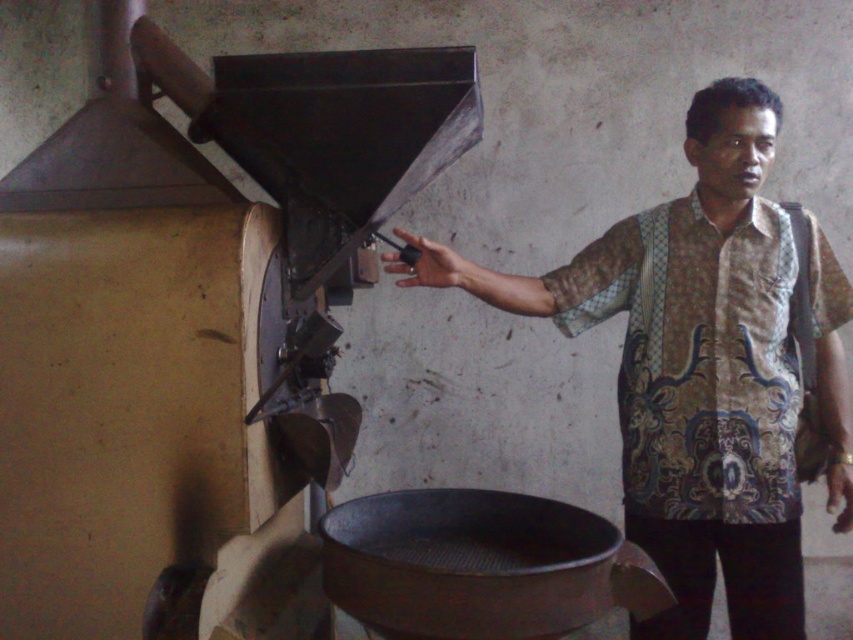
Which is in front, point (621, 225) or point (732, 518)?

Point (732, 518) is more forward.

Does batik shirt at center appear on the right side of batik fabric shirt at right?

In fact, batik shirt at center is to the left of batik fabric shirt at right.

Which is behind, point (587, 298) or point (840, 275)?

Point (840, 275)

What are the coordinates of `batik shirt at center` in the screenshot? It's located at (699, 371).

Does batik fabric shirt at right have a larger size compared to metallic at left?

Yes, batik fabric shirt at right is bigger than metallic at left.

Who is shorter, batik fabric shirt at right or metallic at left?

metallic at left

Locate an element on the screen. This screenshot has width=853, height=640. batik fabric shirt at right is located at coordinates (695, 356).

Is point (656, 618) positioned in front of point (828, 371)?

That is False.

Is batik shirt at center to the left of matte brown hand at center from the viewer's perspective?

Yes, batik shirt at center is to the left of matte brown hand at center.

Is point (738, 243) closer to viewer compared to point (830, 346)?

That is True.

Where is `batik shirt at center`? batik shirt at center is located at coordinates (699, 371).